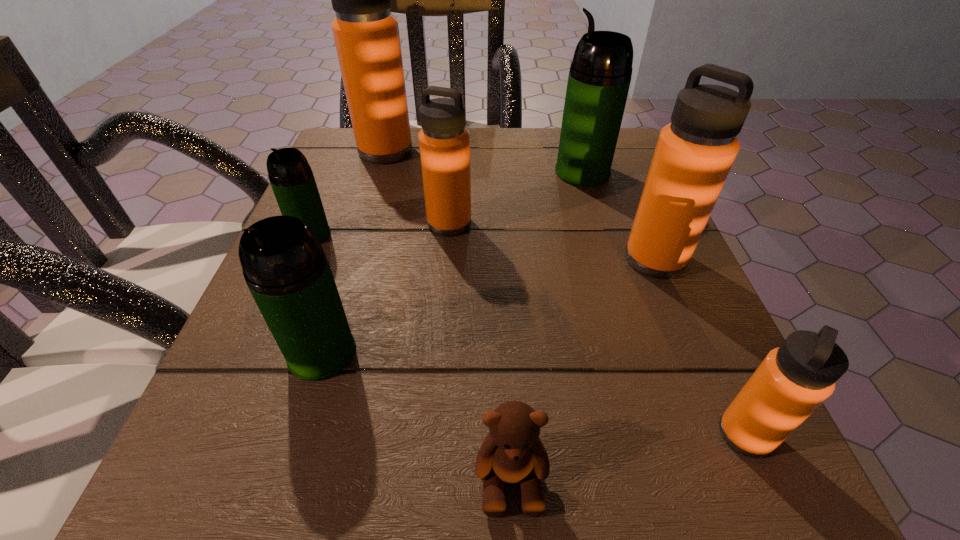
In the image, there is a desktop. Where is `vacant region at the near edge`? The width and height of the screenshot is (960, 540). vacant region at the near edge is located at coordinates (621, 463).

What are the coordinates of `free space at the left edge of the desktop` in the screenshot? It's located at (362, 310).

Identify the location of vacant space at the right edge of the desktop. The width and height of the screenshot is (960, 540). (606, 218).

Identify the location of free location at the far left corner. This screenshot has width=960, height=540. (351, 146).

Find the location of a particular element. This screenshot has width=960, height=540. free space between the second biggest orange thermos bottle and the second nearest green thermos bottle is located at coordinates (483, 247).

The height and width of the screenshot is (540, 960). I want to click on free space between the third orange thermos bottle from right to left and the biggest orange thermos bottle, so click(x=418, y=187).

Image resolution: width=960 pixels, height=540 pixels. Identify the location of vacant space that's between the rightmost green thermos bottle and the second smallest green thermos bottle. (452, 262).

Find the location of a particular element. Image resolution: width=960 pixels, height=540 pixels. free space between the fourth object from left to right and the teddy bear is located at coordinates (480, 350).

Locate an element on the screen. free space between the tallest thermos bottle and the nearest thermos bottle is located at coordinates (565, 293).

Where is `vacant region between the third nearest object and the brown teddy bear`? The image size is (960, 540). vacant region between the third nearest object and the brown teddy bear is located at coordinates (417, 415).